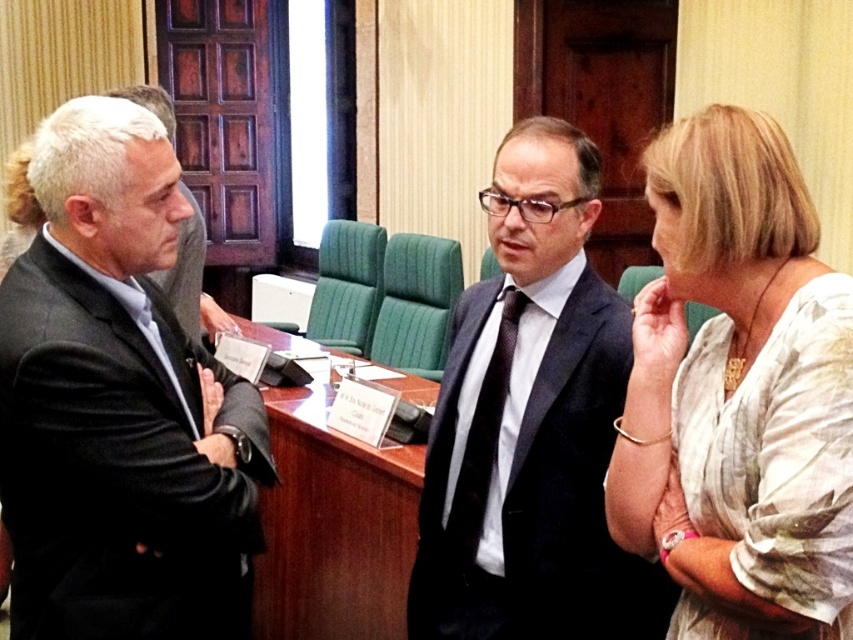
Is dark gray suit at left taller than white textured blouse at center?

Yes.

Can you confirm if dark gray suit at left is thinner than white textured blouse at center?

No, dark gray suit at left is not thinner than white textured blouse at center.

Locate an element on the screen. The height and width of the screenshot is (640, 853). dark gray suit at left is located at coordinates (119, 404).

Who is shorter, wooden at center or black dotted tie at center?

Standing shorter between the two is black dotted tie at center.

Is the position of wooden at center less distant than that of black dotted tie at center?

No, it is not.

Who is more distant from viewer, (386, 532) or (454, 538)?

Positioned behind is point (386, 532).

Identify the location of wooden at center. (334, 525).

Can you confirm if dark gray suit at left is bigger than black dotted tie at center?

Yes.

Does dark gray suit at left appear over black dotted tie at center?

Correct, dark gray suit at left is located above black dotted tie at center.

This screenshot has width=853, height=640. What do you see at coordinates (119, 404) in the screenshot?
I see `dark gray suit at left` at bounding box center [119, 404].

The height and width of the screenshot is (640, 853). I want to click on dark gray suit at left, so click(x=119, y=404).